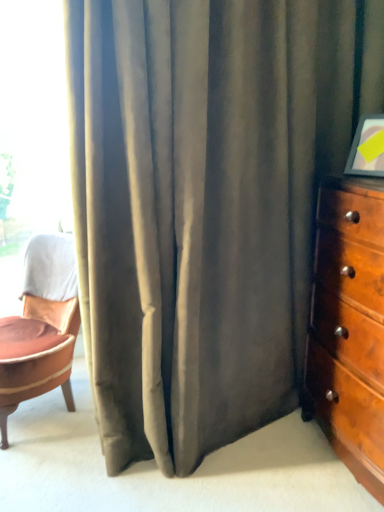
Question: From the image's perspective, is leather cushioned chair at left located above or below wooden dresser at right?

Choices:
 (A) above
 (B) below

Answer: (B)

Question: Is leather cushioned chair at left wider or thinner than wooden dresser at right?

Choices:
 (A) thin
 (B) wide

Answer: (B)

Question: Estimate the real-world distances between objects in this image. Which object is closer to the leather cushioned chair at left?

Choices:
 (A) wooden dresser at right
 (B) transparent glass window at upper left

Answer: (B)

Question: Based on their relative distances, which object is nearer to the transparent glass window at upper left?

Choices:
 (A) leather cushioned chair at left
 (B) wooden dresser at right

Answer: (A)